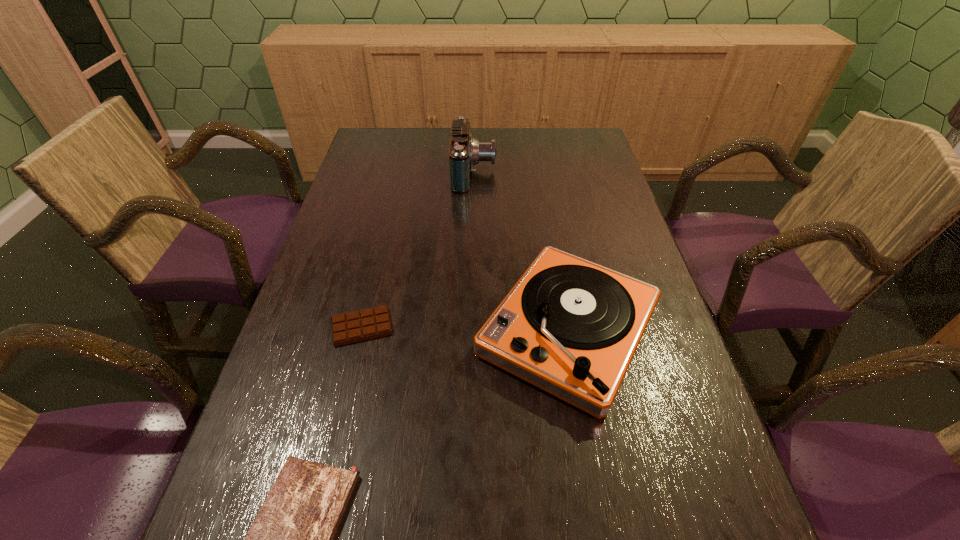
Find the location of a particular element. The image size is (960, 540). free location at the far edge of the desktop is located at coordinates (484, 139).

The width and height of the screenshot is (960, 540). In the image, there is a desktop. What are the coordinates of `vacant space at the left edge` in the screenshot? It's located at (337, 215).

In the image, there is a desktop. Where is `blank space at the right edge`? blank space at the right edge is located at coordinates (720, 464).

This screenshot has height=540, width=960. In the image, there is a desktop. Find the location of `vacant space at the far left corner`. vacant space at the far left corner is located at coordinates (398, 130).

I want to click on vacant space at the far right corner of the desktop, so click(x=562, y=139).

Locate an element on the screen. free point between the farthest object and the record player is located at coordinates (521, 252).

Image resolution: width=960 pixels, height=540 pixels. I want to click on free space that is in between the candy bar and the farthest object, so click(x=419, y=250).

You are a GUI agent. You are given a task and a screenshot of the screen. Output one action in this format:
    pyautogui.click(x=<x>, y=<y>)
    Task: Click on the free space between the farthest object and the second tallest object
    
    Given the screenshot: What is the action you would take?
    pyautogui.click(x=521, y=252)

This screenshot has width=960, height=540. What are the coordinates of `vacant point located between the candy bar and the camcorder` in the screenshot? It's located at (419, 250).

Find the location of a particular element. The width and height of the screenshot is (960, 540). free spot between the candy bar and the camcorder is located at coordinates (419, 250).